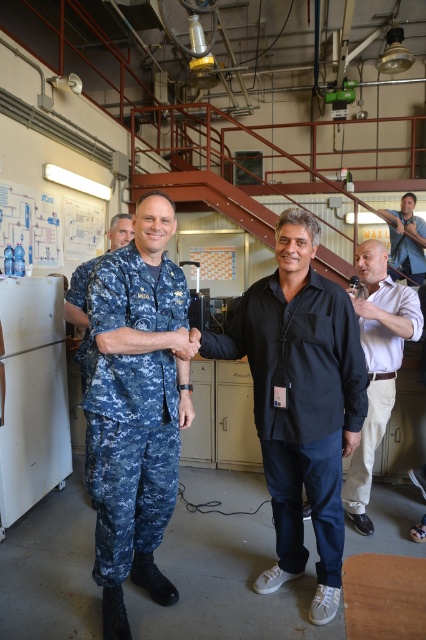
Question: Can you confirm if black cotton shirt at center is positioned to the right of blue denim shirt at upper right?

Choices:
 (A) no
 (B) yes

Answer: (A)

Question: Which point is closer to the camera?

Choices:
 (A) (416, 224)
 (B) (313, 444)
 (C) (146, 440)
 (D) (385, 376)

Answer: (B)

Question: Is digital camouflage uniform at center positioned at the back of blue denim shirt at upper right?

Choices:
 (A) yes
 (B) no

Answer: (B)

Question: Can you confirm if black cotton shirt at center is positioned to the right of blue denim shirt at upper right?

Choices:
 (A) yes
 (B) no

Answer: (B)

Question: Which point is closer to the camera?

Choices:
 (A) black cotton shirt at center
 (B) khaki cotton pants at right

Answer: (A)

Question: Which object is farther from the camera taking this photo?

Choices:
 (A) black cotton shirt at center
 (B) digital camouflage uniform at center
 (C) khaki cotton pants at right
 (D) blue denim shirt at upper right

Answer: (D)